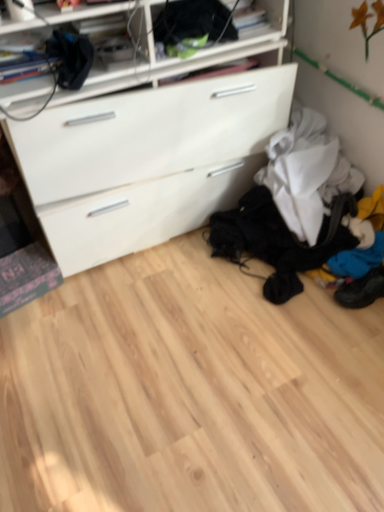
Question: Based on their positions, is black fabric at upper center located to the left or right of blue fabric shoe at lower right?

Choices:
 (A) left
 (B) right

Answer: (A)

Question: Based on their sizes in the image, would you say black fabric at upper center is bigger or smaller than blue fabric shoe at lower right?

Choices:
 (A) small
 (B) big

Answer: (B)

Question: From a real-world perspective, is black fabric at upper center above or below blue fabric shoe at lower right?

Choices:
 (A) below
 (B) above

Answer: (B)

Question: Based on their sizes in the image, would you say blue fabric shoe at lower right is bigger or smaller than black fabric at upper center?

Choices:
 (A) big
 (B) small

Answer: (B)

Question: From the image's perspective, is blue fabric shoe at lower right positioned above or below black fabric at upper center?

Choices:
 (A) above
 (B) below

Answer: (B)

Question: Looking at their shapes, would you say blue fabric shoe at lower right is wider or thinner than black fabric at upper center?

Choices:
 (A) wide
 (B) thin

Answer: (A)

Question: Relative to black fabric at upper center, is blue fabric shoe at lower right in front or behind?

Choices:
 (A) front
 (B) behind

Answer: (B)